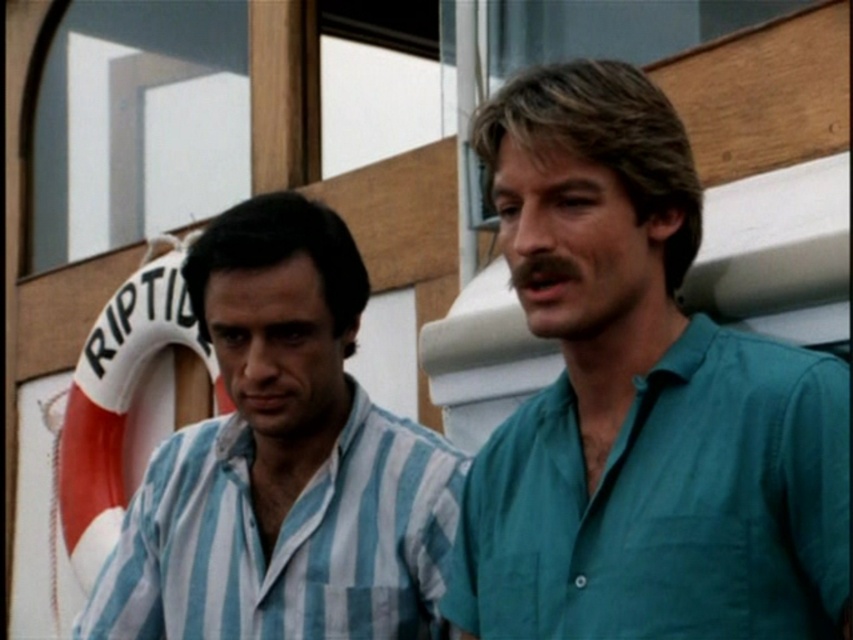
Question: Does teal cotton shirt at right lie behind blue striped shirt at left?

Choices:
 (A) yes
 (B) no

Answer: (B)

Question: Is teal cotton shirt at right to the left of blue striped shirt at left from the viewer's perspective?

Choices:
 (A) no
 (B) yes

Answer: (A)

Question: Which object is farther from the camera taking this photo?

Choices:
 (A) teal cotton shirt at right
 (B) blue striped shirt at left

Answer: (B)

Question: Can you confirm if teal cotton shirt at right is positioned below blue striped shirt at left?

Choices:
 (A) no
 (B) yes

Answer: (A)

Question: Which object is farther from the camera taking this photo?

Choices:
 (A) blue striped shirt at left
 (B) teal cotton shirt at right

Answer: (A)